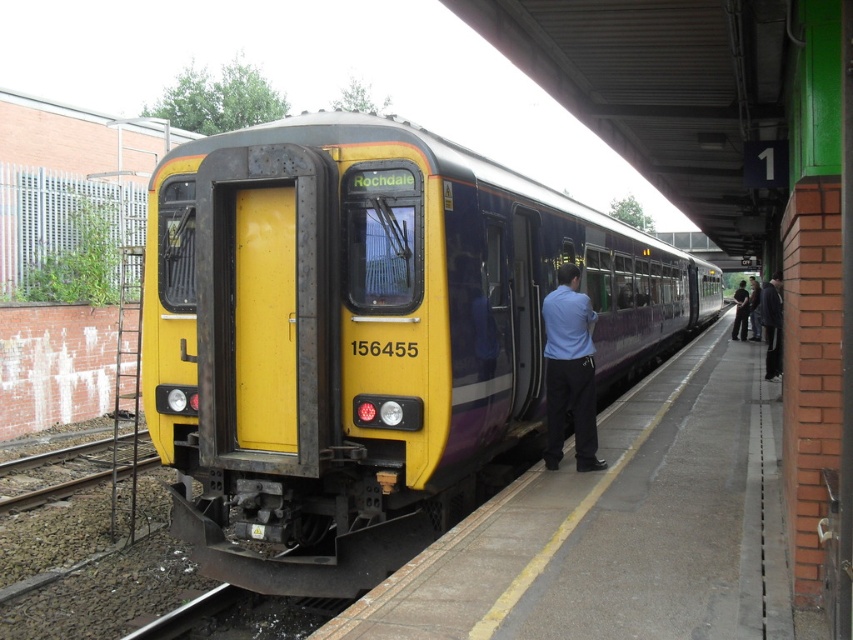
Question: Which object appears closest to the camera in this image?

Choices:
 (A) dark blue jeans at right
 (B) concrete platform at center
 (C) yellow matte train at center

Answer: (B)

Question: Among these objects, which one is nearest to the camera?

Choices:
 (A) concrete platform at center
 (B) yellow matte train at center
 (C) dark gray fabric jacket at right

Answer: (A)

Question: From the image, what is the correct spatial relationship of yellow matte train at center in relation to dark gray fabric jacket at right?

Choices:
 (A) left
 (B) right

Answer: (A)

Question: Observing the image, what is the correct spatial positioning of yellow matte train at center in reference to dark blue jeans at right?

Choices:
 (A) left
 (B) right

Answer: (A)

Question: Considering the real-world distances, which object is closest to the dark gray fabric jacket at right?

Choices:
 (A) yellow matte train at center
 (B) concrete platform at center
 (C) dark blue jeans at right
 (D) matte blue shirt at center

Answer: (C)

Question: Can you confirm if dark blue jeans at right is positioned above dark gray fabric jacket at right?

Choices:
 (A) yes
 (B) no

Answer: (A)